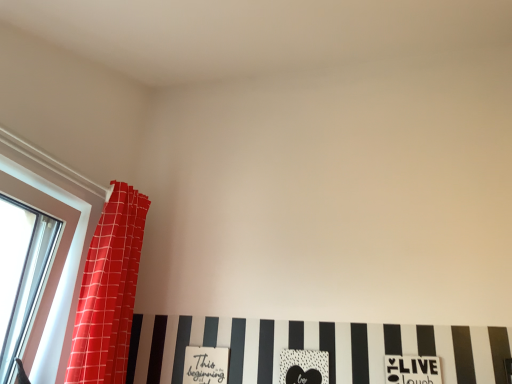
Question: From the image's perspective, is black matte heart at center, placed as the second print when sorted from left to right, below matte white sign at lower center, which is the 1th print in left-to-right order?

Choices:
 (A) yes
 (B) no

Answer: (B)

Question: Considering the relative sizes of black matte heart at center, placed as the second print when sorted from right to left, and matte white sign at lower center, which is the 1th print in left-to-right order, in the image provided, is black matte heart at center, placed as the second print when sorted from right to left, taller than matte white sign at lower center, which is the 1th print in left-to-right order,?

Choices:
 (A) yes
 (B) no

Answer: (B)

Question: From the image's perspective, would you say black matte heart at center, placed as the second print when sorted from left to right, is positioned over matte white sign at lower center, which is the third print from right to left?

Choices:
 (A) yes
 (B) no

Answer: (A)

Question: From a real-world perspective, is black matte heart at center, placed as the second print when sorted from left to right, under matte white sign at lower center, which is the 1th print in left-to-right order?

Choices:
 (A) yes
 (B) no

Answer: (B)

Question: Is black matte heart at center, placed as the second print when sorted from right to left, positioned beyond the bounds of matte white sign at lower center, which is the third print from right to left?

Choices:
 (A) no
 (B) yes

Answer: (B)

Question: From their relative heights in the image, would you say matte white sign at lower center, which is the third print from right to left, is taller or shorter than black matte heart at center, placed as the second print when sorted from left to right?

Choices:
 (A) tall
 (B) short

Answer: (A)

Question: Would you say matte white sign at lower center, which is the third print from right to left, is inside or outside black matte heart at center, placed as the second print when sorted from left to right?

Choices:
 (A) inside
 (B) outside

Answer: (B)

Question: In the image, is matte white sign at lower center, which is the third print from right to left, positioned in front of or behind black matte heart at center, placed as the second print when sorted from left to right?

Choices:
 (A) front
 (B) behind

Answer: (B)

Question: Looking at their shapes, would you say matte white sign at lower center, which is the 1th print in left-to-right order, is wider or thinner than black matte heart at center, placed as the second print when sorted from left to right?

Choices:
 (A) thin
 (B) wide

Answer: (A)

Question: From the image's perspective, is matte white sign at lower center, which is the 1th print in left-to-right order, positioned above or below clear glass window at left?

Choices:
 (A) above
 (B) below

Answer: (B)

Question: From a real-world perspective, is matte white sign at lower center, which is the third print from right to left, positioned above or below clear glass window at left?

Choices:
 (A) below
 (B) above

Answer: (A)

Question: In terms of width, does matte white sign at lower center, which is the 1th print in left-to-right order, look wider or thinner when compared to clear glass window at left?

Choices:
 (A) thin
 (B) wide

Answer: (A)

Question: Considering the positions of point (210, 377) and point (31, 162), is point (210, 377) closer or farther from the camera than point (31, 162)?

Choices:
 (A) farther
 (B) closer

Answer: (A)

Question: In terms of width, does black matte heart at center, placed as the second print when sorted from left to right, look wider or thinner when compared to white matte print at lower center, the third print from the left?

Choices:
 (A) thin
 (B) wide

Answer: (B)

Question: In the image, is black matte heart at center, placed as the second print when sorted from left to right, on the left side or the right side of white matte print at lower center, the 1th print in the right-to-left sequence?

Choices:
 (A) left
 (B) right

Answer: (A)